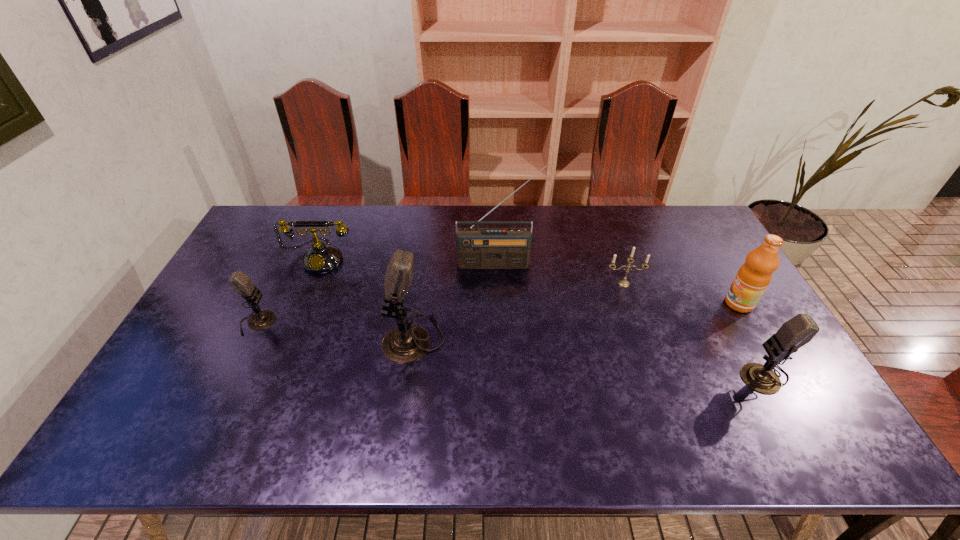
This screenshot has height=540, width=960. I want to click on vacant space at the left edge, so click(x=252, y=276).

The image size is (960, 540). In the image, there is a desktop. Identify the location of blank space at the right edge. (692, 255).

At what (x,y) coordinates should I click in order to perform the action: click on vacant space at the far right corner of the desktop. Please return your answer as a coordinate pair (x, y). This screenshot has width=960, height=540. Looking at the image, I should click on (691, 241).

This screenshot has height=540, width=960. Identify the location of vacant space that is in between the telephone and the third object from right to left. (472, 271).

Identify the location of empty location between the candle and the fruit juice. (682, 294).

Where is `free spot between the candle and the second tallest microphone`? free spot between the candle and the second tallest microphone is located at coordinates (693, 329).

I want to click on vacant space in between the telephone and the second shortest microphone, so click(x=542, y=316).

You are a GUI agent. You are given a task and a screenshot of the screen. Output one action in this format:
    pyautogui.click(x=<x>, y=<y>)
    Task: Click on the free point between the second tallest microphone and the candle
    The image size is (960, 540).
    Given the screenshot: What is the action you would take?
    pyautogui.click(x=693, y=329)

Where is `free space between the fruit juice and the fifth object from left to right`? The width and height of the screenshot is (960, 540). free space between the fruit juice and the fifth object from left to right is located at coordinates (682, 294).

Identify the location of empty location between the shortest microphone and the fruit juice. (498, 313).